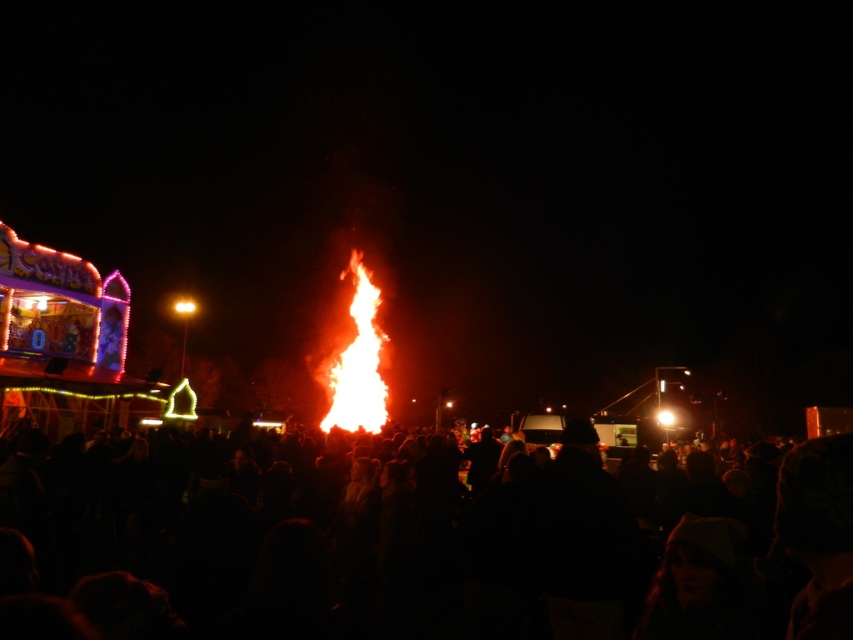
Does black matte crowd at center have a smaller size compared to flame at center?

No.

Who is positioned more to the left, black matte crowd at center or flame at center?

Positioned to the left is flame at center.

Identify the location of black matte crowd at center. (369, 548).

This screenshot has height=640, width=853. In order to click on black matte crowd at center in this screenshot , I will do `click(369, 548)`.